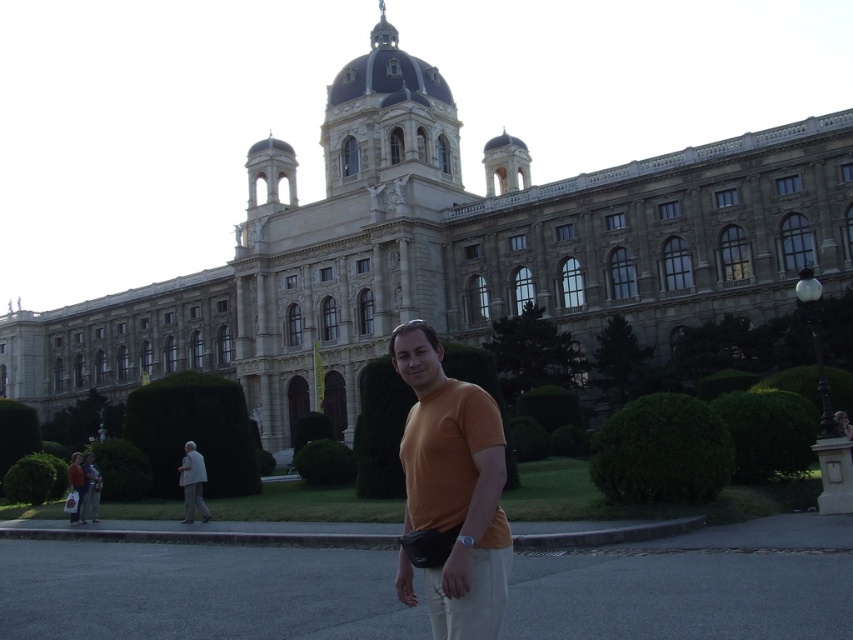
You are standing at the base of the grand historic building and see the orange cotton shirt at center and the light gray fabric jacket at lower left. Which object is farther away from you?

The orange cotton shirt at center is farther away from you than the light gray fabric jacket at lower left because it is 88.87 feet away from the jacket.